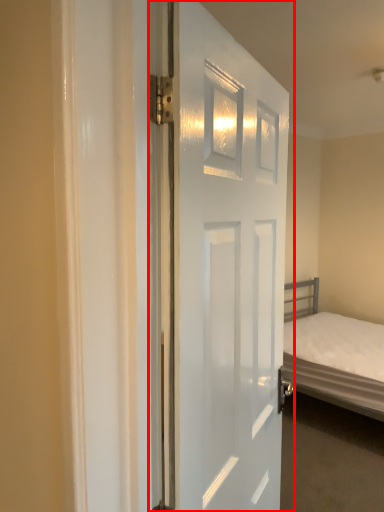
Question: From the image's perspective, where is door (annotated by the red box) located in relation to bed in the image?

Choices:
 (A) above
 (B) below

Answer: (A)